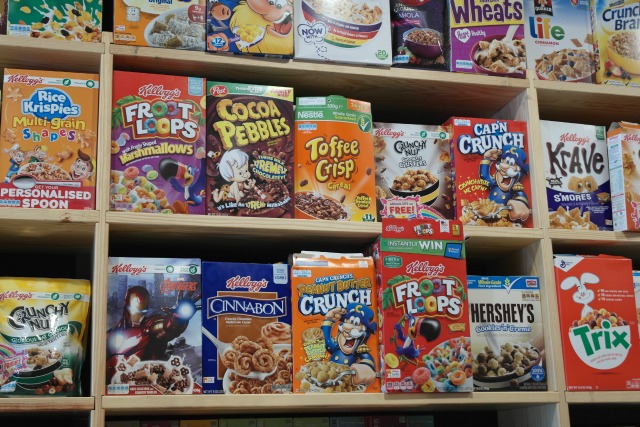
Identify the location of boxes of cereal on the top shelf. This screenshot has width=640, height=427. (61, 32), (168, 28), (253, 35), (333, 39), (416, 41), (496, 44), (559, 52), (621, 52).